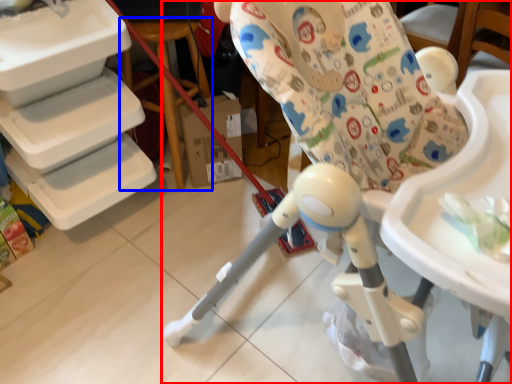
Question: Which of the following is the closest to the observer, chair (highlighted by a red box) or table (highlighted by a blue box)?

Choices:
 (A) chair
 (B) table

Answer: (A)